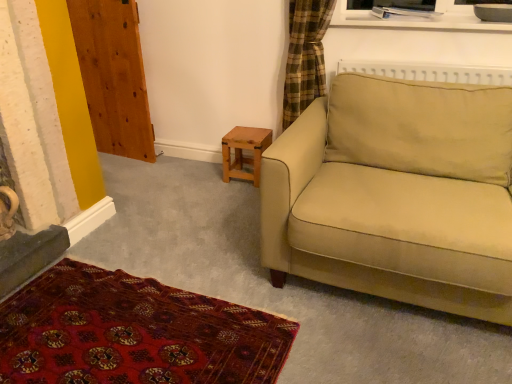
You are a GUI agent. You are given a task and a screenshot of the screen. Output one action in this format:
    pyautogui.click(x=<x>, y=<y>)
    Task: Click on the free location above wooden stool at lower center (from a real-world perspective)
    This screenshot has width=512, height=384.
    Given the screenshot: What is the action you would take?
    pyautogui.click(x=247, y=130)